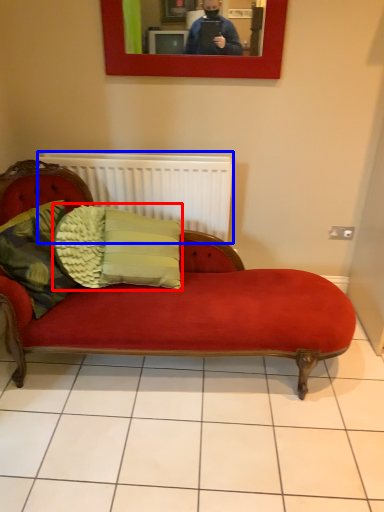
Question: Among these objects, which one is nearest to the camera, pillow (highlighted by a red box) or radiator (highlighted by a blue box)?

Choices:
 (A) pillow
 (B) radiator

Answer: (A)